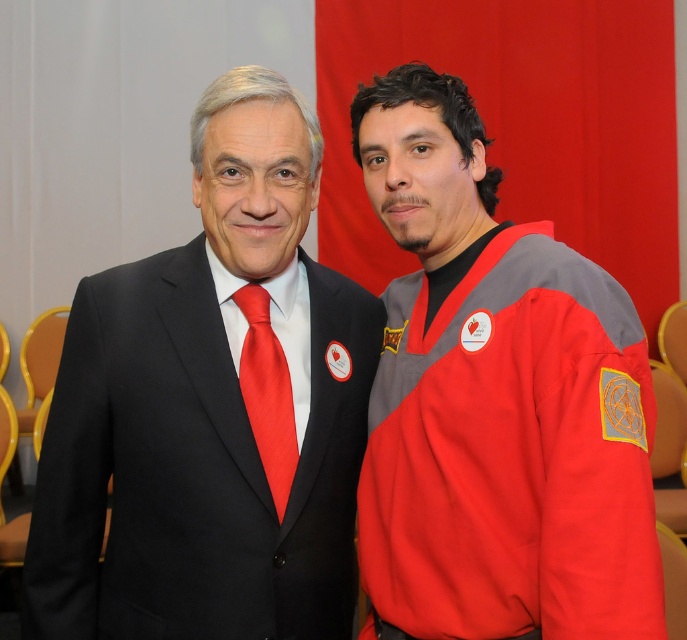
Question: Is matte red hockey jersey at right to the right of shiny silk tie at center from the viewer's perspective?

Choices:
 (A) no
 (B) yes

Answer: (B)

Question: Is matte black suit at center below shiny silk tie at center?

Choices:
 (A) yes
 (B) no

Answer: (B)

Question: Is the position of matte red hockey jersey at right more distant than that of shiny silk tie at center?

Choices:
 (A) no
 (B) yes

Answer: (A)

Question: Which object appears closest to the camera in this image?

Choices:
 (A) matte red hockey jersey at right
 (B) matte black suit at center

Answer: (A)

Question: Among these points, which one is farthest from the camera?

Choices:
 (A) (576, 438)
 (B) (322, 452)
 (C) (275, 461)

Answer: (B)

Question: Which is farther from the matte black suit at center?

Choices:
 (A) shiny silk tie at center
 (B) matte red hockey jersey at right

Answer: (B)